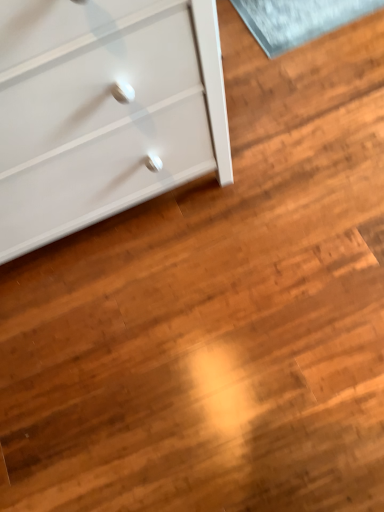
What are the coordinates of `vacant area that is situated to the right of white glossy chest of drawers at upper left` in the screenshot? It's located at (295, 122).